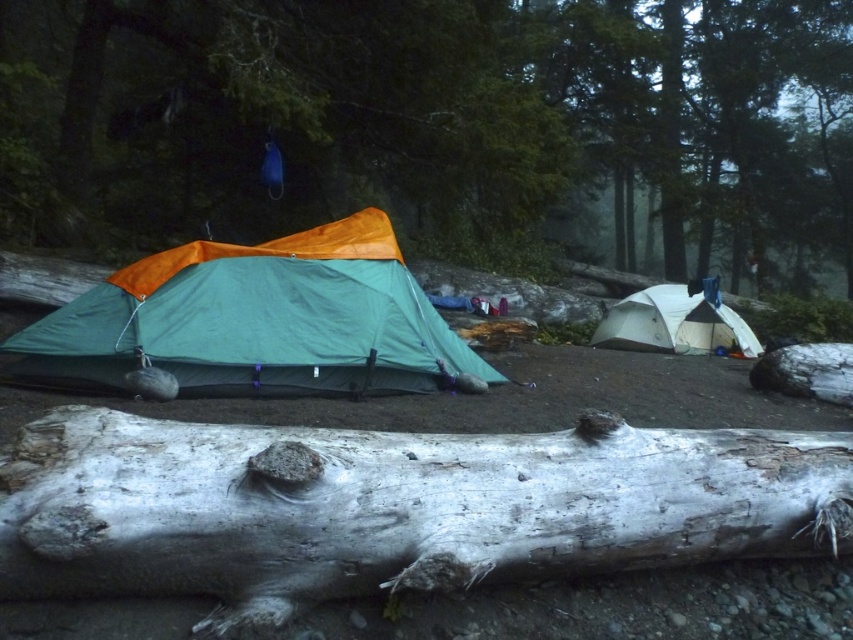
You are a hiker who wants to place a heavy backpack on the log that is higher up. Which log should you choose between the smooth gray log at center and the white rough bark log at lower center?

The smooth gray log at center is above the white rough bark log at lower center, so you should choose the smooth gray log at center to place your heavy backpack.